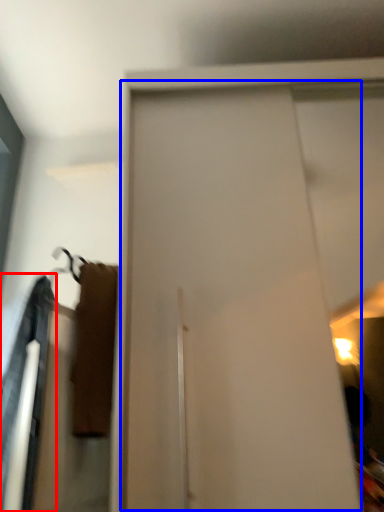
Question: Which object appears farthest to the camera in this image, robe (highlighted by a red box) or screen door (highlighted by a blue box)?

Choices:
 (A) robe
 (B) screen door

Answer: (A)